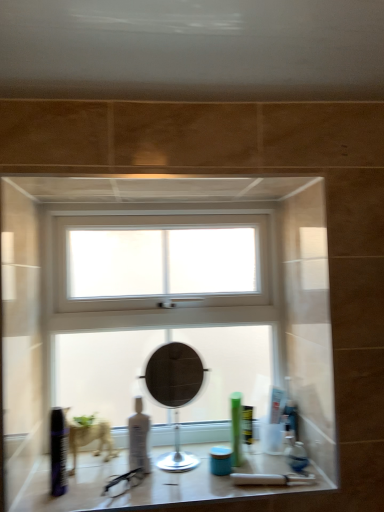
At what (x,y) coordinates should I click in order to perform the action: click on vacant area in front of transparent plastic bottle at center, which is the third toiletry from right to left. Please return your answer as a coordinate pair (x, y). This screenshot has height=512, width=384. Looking at the image, I should click on (139, 495).